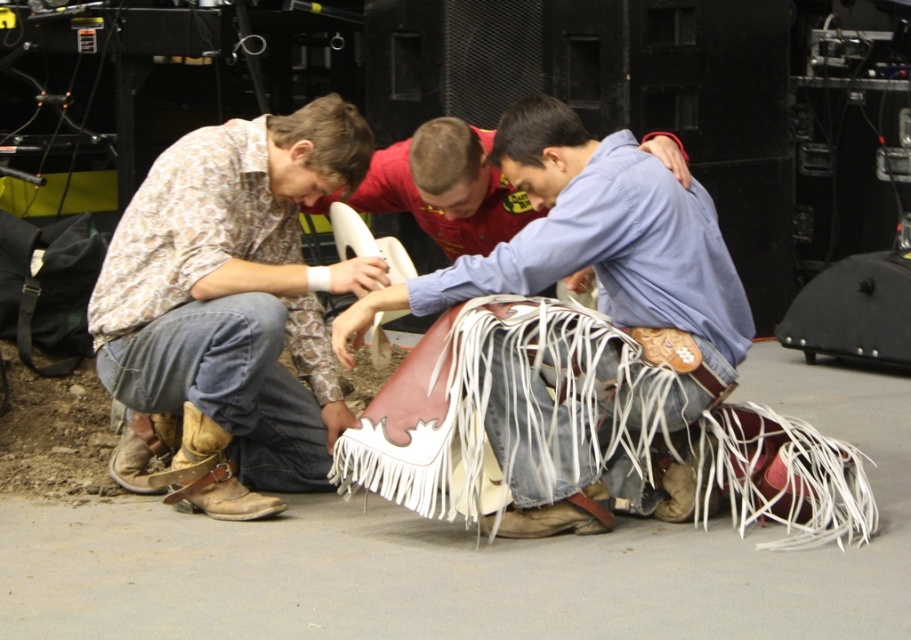
Question: Is camouflage shirt at left positioned before leather fringe skirt at center?

Choices:
 (A) yes
 (B) no

Answer: (B)

Question: Observing the image, what is the correct spatial positioning of camouflage shirt at left in reference to leather fringe skirt at center?

Choices:
 (A) left
 (B) right

Answer: (A)

Question: Which of the following is the farthest from the observer?

Choices:
 (A) camouflage shirt at left
 (B) leather fringe skirt at center
 (C) brown leather cowboy boot at lower left

Answer: (C)

Question: Which of the following is the farthest from the observer?

Choices:
 (A) (476, 278)
 (B) (213, 499)
 (C) (259, 371)

Answer: (B)

Question: Which point is closer to the camera?

Choices:
 (A) camouflage shirt at left
 (B) leather fringe skirt at center

Answer: (B)

Question: From the image, what is the correct spatial relationship of camouflage shirt at left in relation to leather fringe skirt at center?

Choices:
 (A) above
 (B) below

Answer: (B)